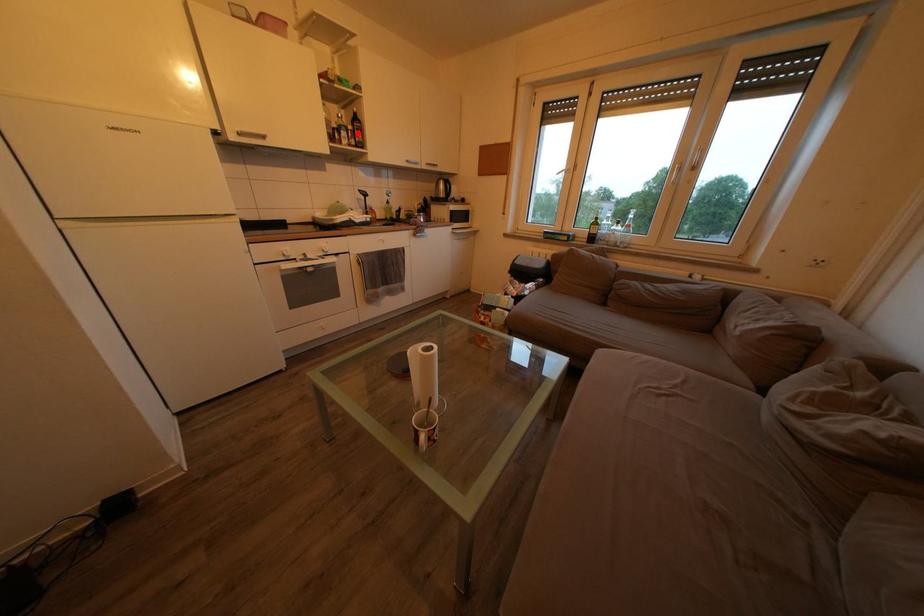
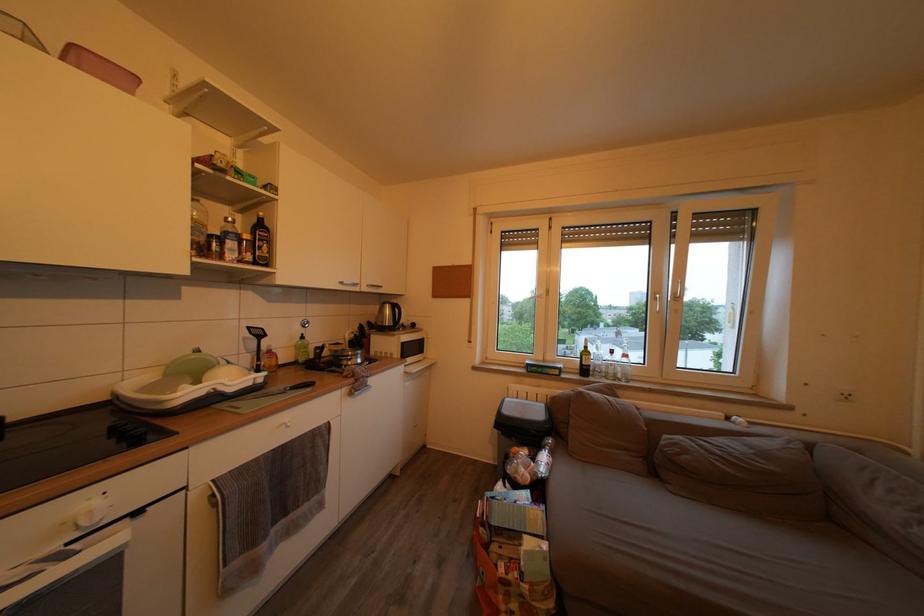
Locate, in the second image, the point that corresponds to the highlighted location in the first image.

(253, 243)